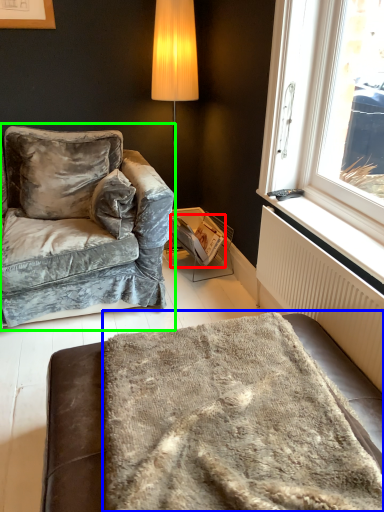
Question: Which object is positioned closest to magazine (highlighted by a red box)? Select from blanket (highlighted by a blue box) and studio couch (highlighted by a green box).

Choices:
 (A) blanket
 (B) studio couch

Answer: (B)